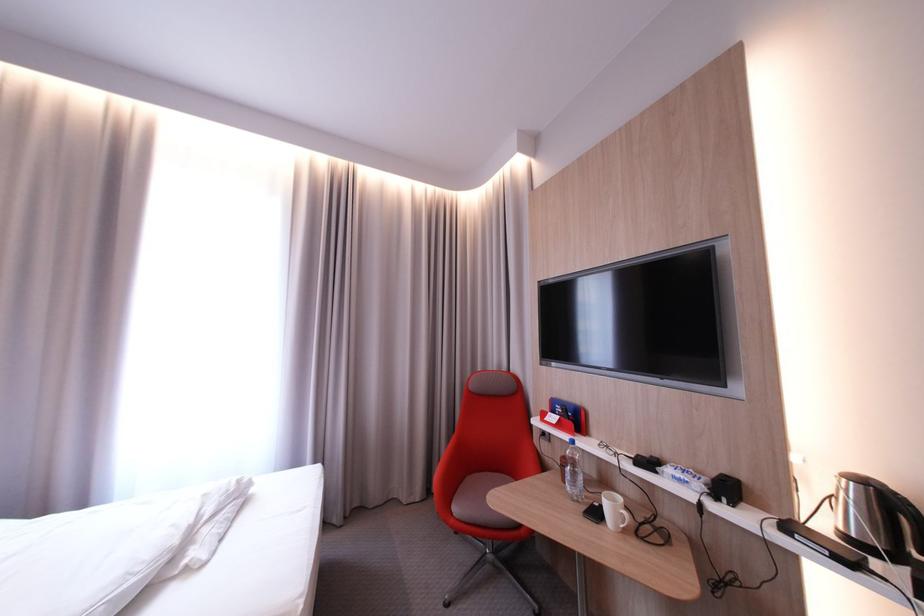
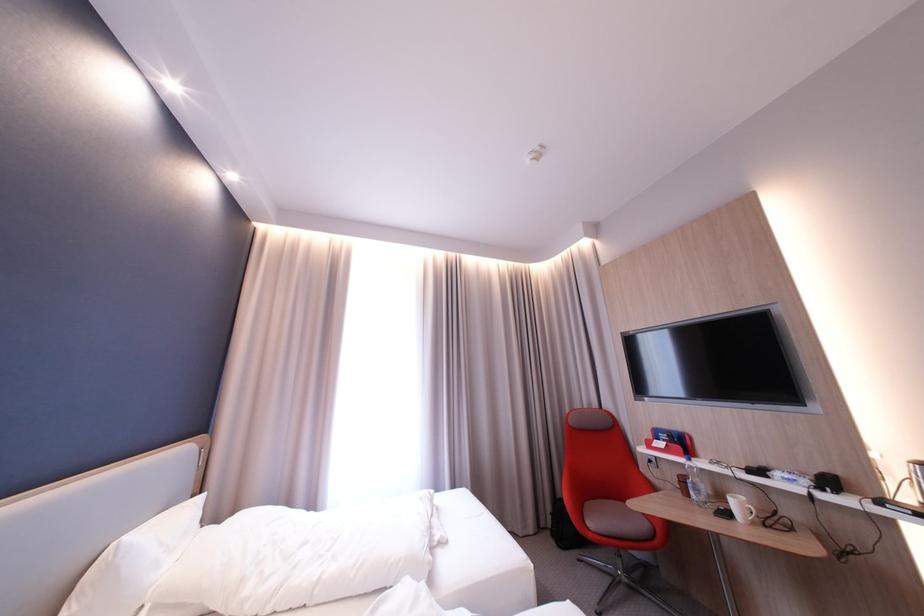
In the second image, find the point that corresponds to point (576, 482) in the first image.

(698, 495)